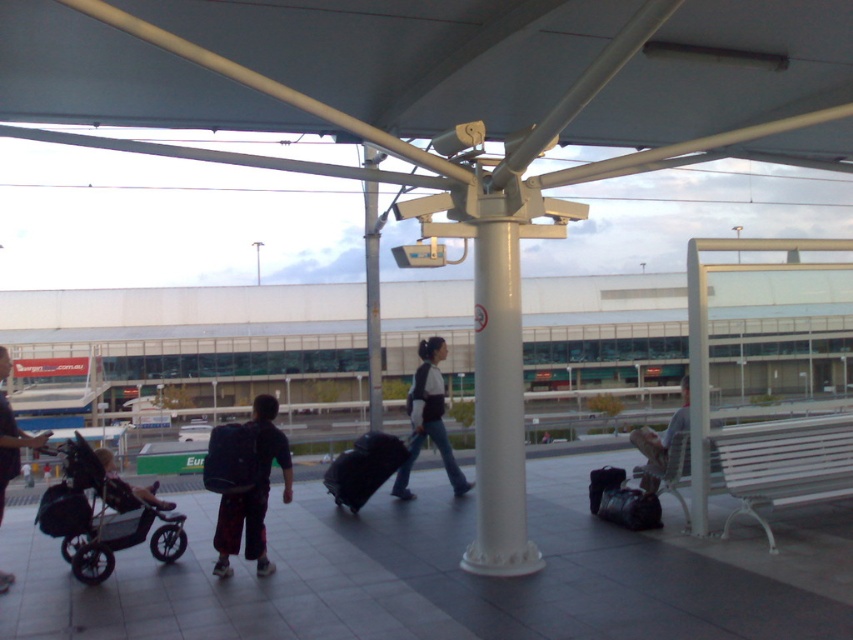
You are a traveler who just arrived at the airport terminal. You see a dark blue backpack at center and a black fabric suitcase at center. Which one is nearer to you?

The dark blue backpack at center is closer to the viewer than the black fabric suitcase at center.

You are a traveler at the airport terminal. You need to place your dark blue backpack at lower left near the black rubber baby carriage at lower left. Which side of the baby carriage should you place it on?

The black rubber baby carriage at lower left is positioned on the left side of dark blue backpack at lower left, so you should place the dark blue backpack at lower left to the right of the baby carriage.

You are standing at the point marked by coordinates point (x=100, y=518) in the airport terminal. Looking around, you see a black rubber baby carriage at lower left. Which direction should you walk to reach the person with the wheeled suitcase in the center?

Since the black rubber baby carriage at lower left is located at point (x=100, y=518), you should walk towards the center of the terminal to reach the person with the wheeled suitcase in the center.